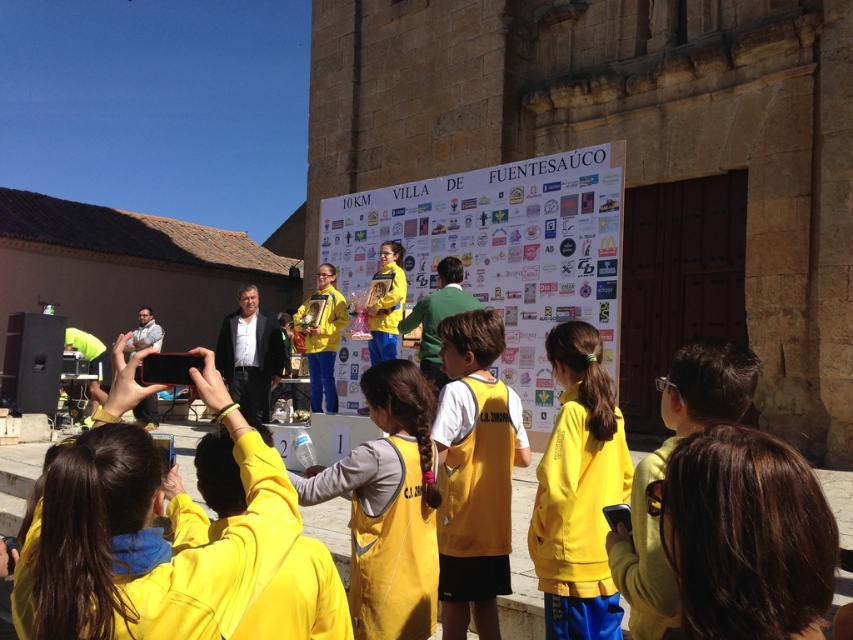
Question: Which point is closer to the camera taking this photo?

Choices:
 (A) (567, 244)
 (B) (463, 557)
 (C) (351, 477)

Answer: (C)

Question: Is white paper at center in front of yellow fabric shirt at center?

Choices:
 (A) yes
 (B) no

Answer: (B)

Question: Which point is closer to the camera taking this photo?

Choices:
 (A) (643, 477)
 (B) (796, 525)
 (C) (415, 371)
 (D) (582, 237)

Answer: (B)

Question: Among these objects, which one is nearest to the camera?

Choices:
 (A) yellow fabric jacket at center
 (B) white paper at center
 (C) brown smooth hair at lower center

Answer: (C)

Question: Observing the image, what is the correct spatial positioning of yellow fabric jacket at center in reference to yellow matte jacket at center?

Choices:
 (A) right
 (B) left

Answer: (B)

Question: Is white paper at center smaller than yellow fabric jacket at center?

Choices:
 (A) no
 (B) yes

Answer: (A)